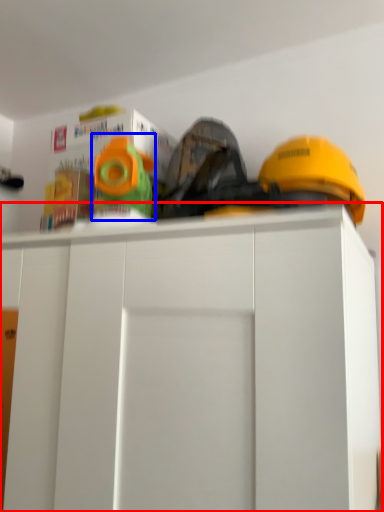
Question: Among these objects, which one is farthest to the camera, cabinetry (highlighted by a red box) or toy (highlighted by a blue box)?

Choices:
 (A) cabinetry
 (B) toy

Answer: (B)